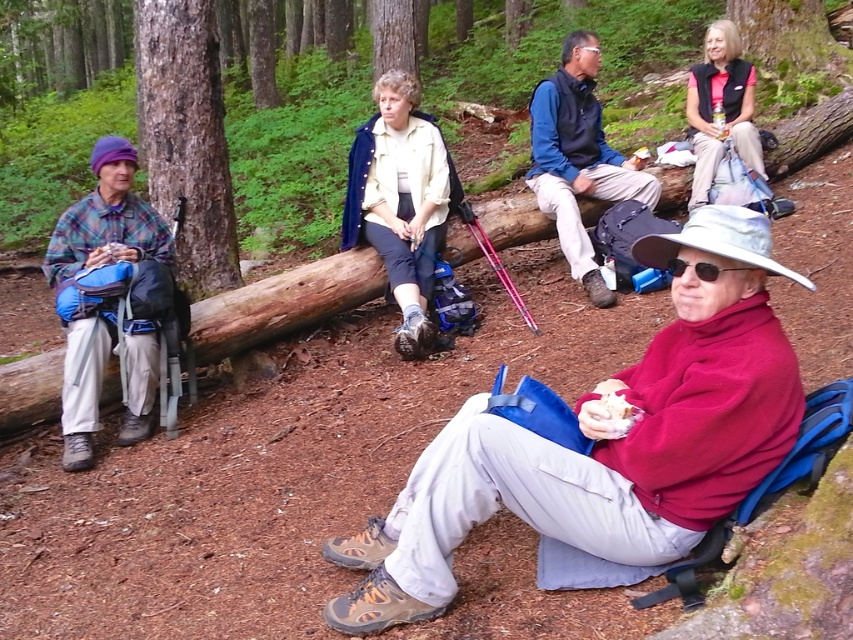
Which is above, plaid fabric shirt at left or black plastic sunglasses at lower center?

Positioned higher is black plastic sunglasses at lower center.

This screenshot has width=853, height=640. Identify the location of plaid fabric shirt at left. coord(106,220).

You are a GUI agent. You are given a task and a screenshot of the screen. Output one action in this format:
    pyautogui.click(x=<x>, y=<y>)
    Task: Click on the plaid fabric shirt at left
    This screenshot has height=640, width=853.
    Given the screenshot: What is the action you would take?
    pyautogui.click(x=106, y=220)

Who is taller, plaid fabric shirt at left or blue fabric backpack at center?

blue fabric backpack at center is taller.

Can you confirm if plaid fabric shirt at left is positioned above blue fabric backpack at center?

No.

Between point (132, 388) and point (595, 124), which one is positioned in front?

Point (132, 388) is more forward.

Image resolution: width=853 pixels, height=640 pixels. Find the location of `plaid fabric shirt at left`. plaid fabric shirt at left is located at coordinates (106, 220).

Can you confirm if matte black vest at upper right is wider than smooth bark tree at center?

Yes.

Is matte black vest at upper right above smooth bark tree at center?

Actually, matte black vest at upper right is below smooth bark tree at center.

Which is behind, point (699, 173) or point (397, 10)?

Point (397, 10)

At what (x,y) coordinates should I click in order to perform the action: click on matte black vest at upper right. Please return your answer as a coordinate pair (x, y). This screenshot has width=853, height=640. Looking at the image, I should click on (720, 108).